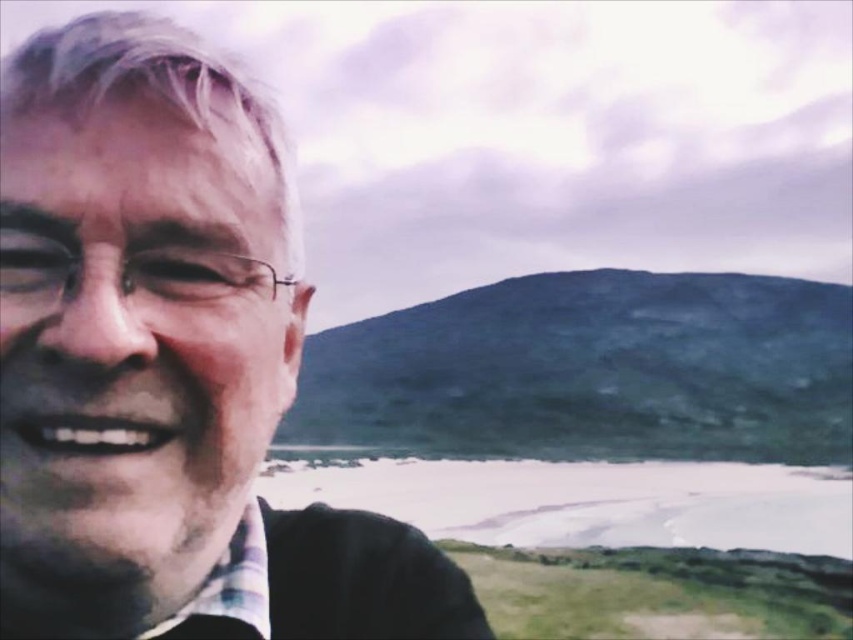
Measure the distance from matte black face at left to plaid fabric shirt at lower left.

The distance of matte black face at left from plaid fabric shirt at lower left is 13.82 inches.

The height and width of the screenshot is (640, 853). What do you see at coordinates (166, 362) in the screenshot? I see `matte black face at left` at bounding box center [166, 362].

Where is `matte black face at left`? matte black face at left is located at coordinates (166, 362).